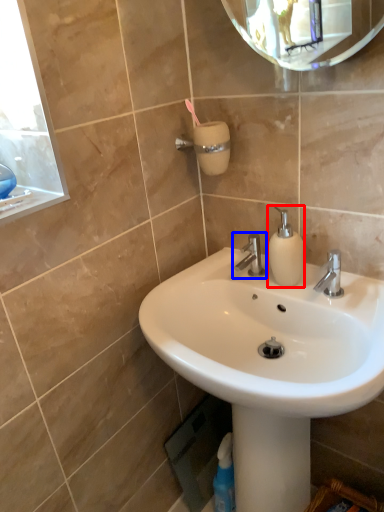
Question: Which point is closer to the camera, soap dispenser (highlighted by a red box) or tap (highlighted by a blue box)?

Choices:
 (A) soap dispenser
 (B) tap

Answer: (A)